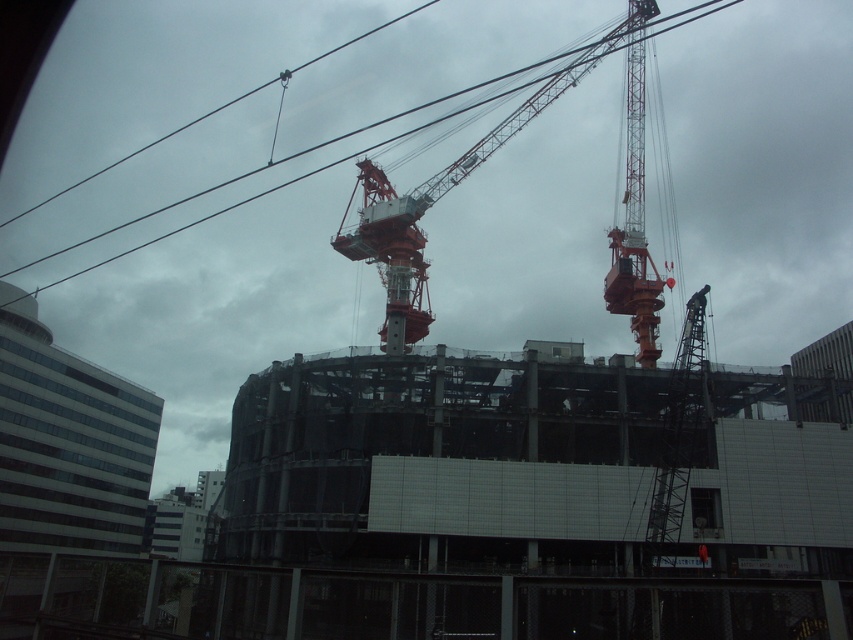
Looking at this image, between metallic gray crane at right and metallic gray lift at center, which one has less height?

metallic gray lift at center is shorter.

Who is more distant from viewer, (672, 552) or (552, 352)?

The point (552, 352) is more distant.

Does point (680, 420) come farther from viewer compared to point (550, 348)?

No, it is in front of (550, 348).

Where is `metallic gray crane at right`? The width and height of the screenshot is (853, 640). metallic gray crane at right is located at coordinates (677, 436).

Who is positioned more to the left, metallic red crane at center or metallic wire at upper center?

metallic wire at upper center

Can you confirm if metallic red crane at center is smaller than metallic wire at upper center?

Yes.

Is point (424, 323) closer to viewer compared to point (570, 52)?

Yes, point (424, 323) is closer to viewer.

This screenshot has height=640, width=853. In order to click on metallic red crane at center in this screenshot , I will do `click(442, 195)`.

Is metallic red crane at center to the left of metallic red crane at upper right from the viewer's perspective?

Indeed, metallic red crane at center is positioned on the left side of metallic red crane at upper right.

Can you confirm if metallic red crane at center is thinner than metallic red crane at upper right?

In fact, metallic red crane at center might be wider than metallic red crane at upper right.

Is point (601, 52) closer to viewer compared to point (628, 205)?

No.

The image size is (853, 640). I want to click on metallic red crane at center, so click(442, 195).